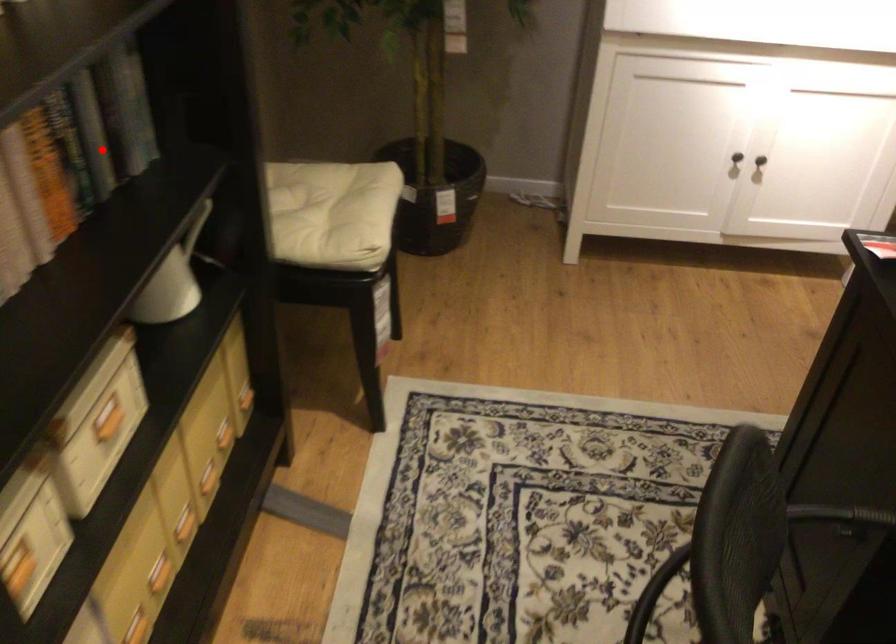
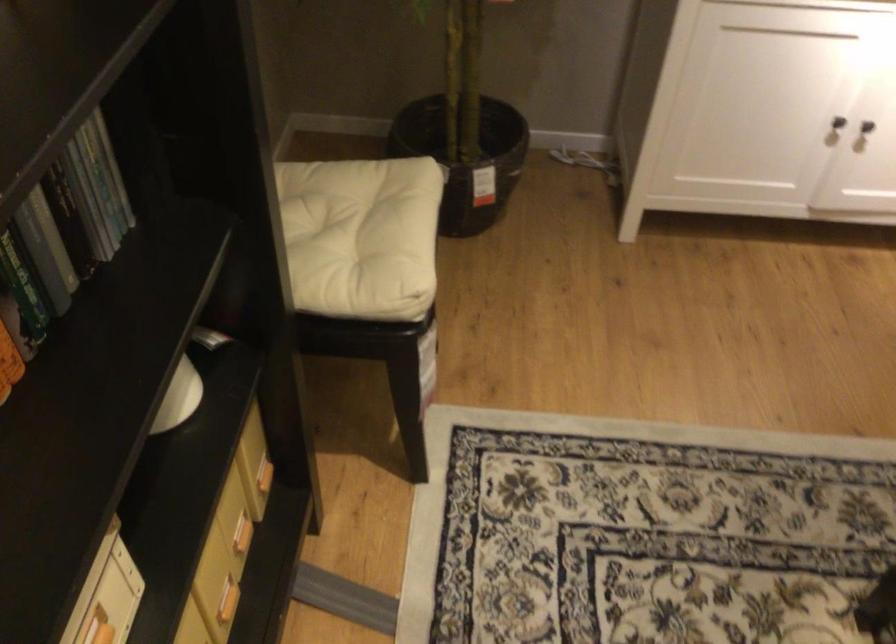
Locate, in the second image, the point that corresponds to the highlighted location in the first image.

(53, 238)